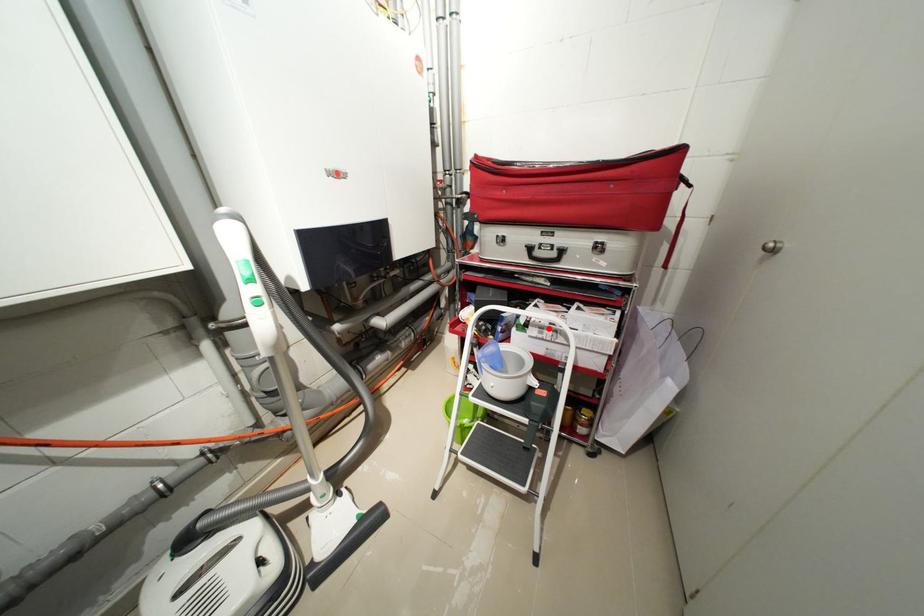
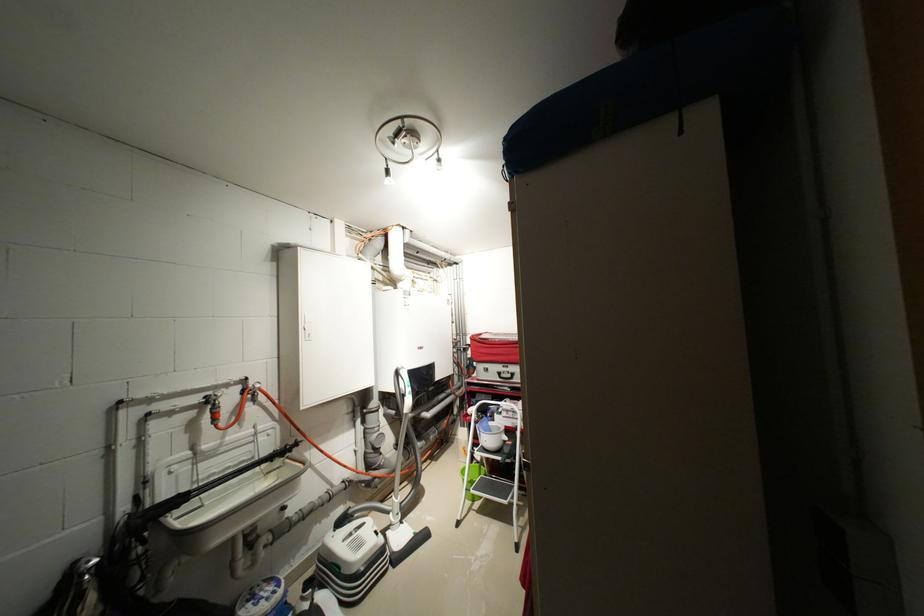
Question: I am providing you with two images of the same scene from different viewpoints. A red point is marked on the first image. Is the red point's position out of view in image 2?

Choices:
 (A) Yes
 (B) No

Answer: (B)